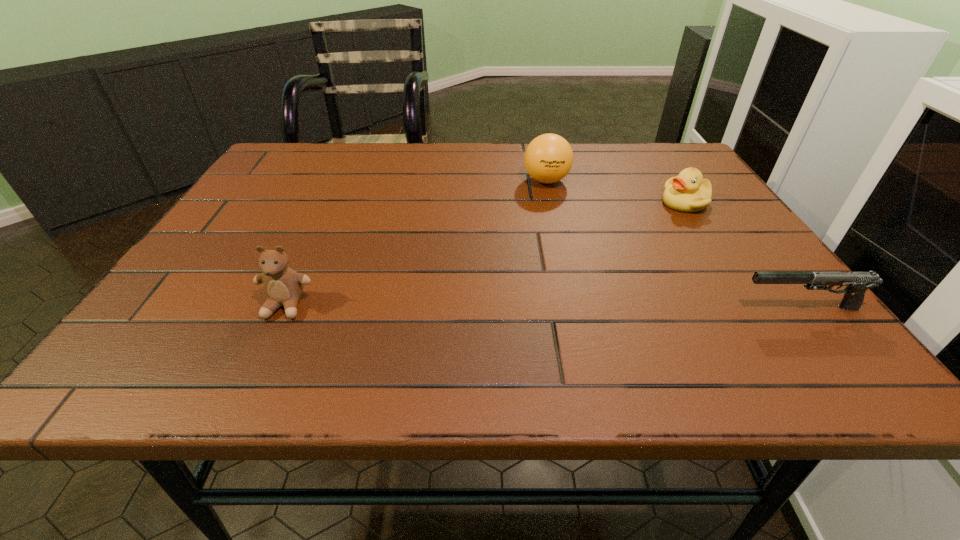
I want to click on free space located on the side with brand of the third object from right to left, so click(x=523, y=242).

At what (x,y) coordinates should I click in order to perform the action: click on vacant space located on the side with brand of the third object from right to left. Please return your answer as a coordinate pair (x, y). Looking at the image, I should click on (530, 225).

The image size is (960, 540). I want to click on vacant region located 0.090m on the side with brand of the third object from right to left, so click(x=535, y=211).

Image resolution: width=960 pixels, height=540 pixels. In order to click on object at the far edge in this screenshot , I will do `click(548, 158)`.

This screenshot has width=960, height=540. What are the coordinates of `teddy bear situated at the near edge` in the screenshot? It's located at (283, 286).

Find the location of a particular element. This screenshot has height=540, width=960. gun at the near edge is located at coordinates (856, 283).

In order to click on gun that is at the right edge in this screenshot , I will do `click(856, 283)`.

This screenshot has width=960, height=540. Identify the location of duckling that is at the right edge. (687, 192).

Identify the location of object that is at the near right corner. The image size is (960, 540). (856, 283).

Image resolution: width=960 pixels, height=540 pixels. Find the location of `vacant area at the far edge of the desktop`. vacant area at the far edge of the desktop is located at coordinates (386, 150).